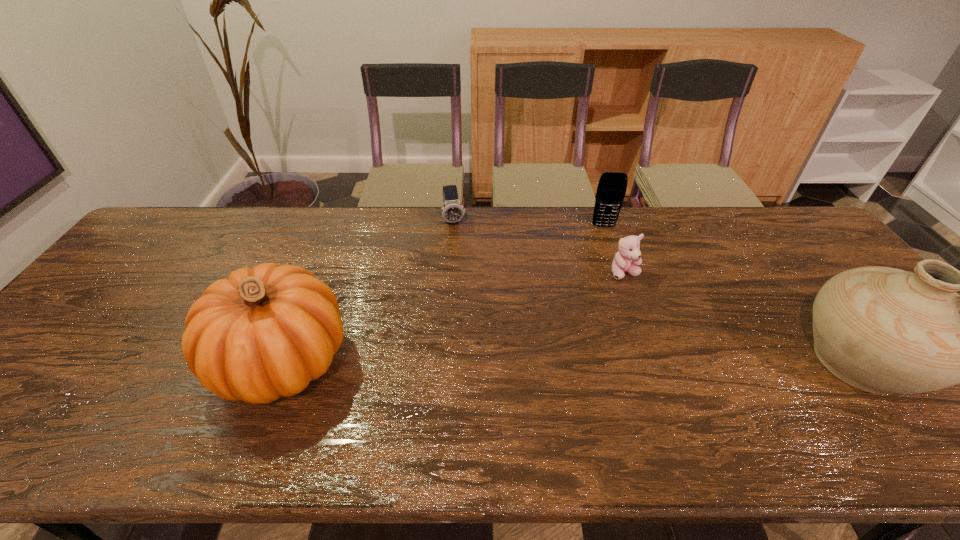
At what (x,y) coordinates should I click in order to perform the action: click on vacant region at the far left corner of the desktop. Please return your answer as a coordinate pair (x, y). The image size is (960, 540). Looking at the image, I should click on (136, 246).

The height and width of the screenshot is (540, 960). What are the coordinates of `vacant space at the far right corner of the desktop` in the screenshot? It's located at (756, 217).

Where is `vacant space at the near right corner of the desktop`? This screenshot has height=540, width=960. vacant space at the near right corner of the desktop is located at coordinates (917, 405).

The image size is (960, 540). What are the coordinates of `free space that is in between the pumpkin and the third shortest object` in the screenshot? It's located at (444, 294).

The image size is (960, 540). What are the coordinates of `free space between the third shortest object and the teddy bear` in the screenshot? It's located at coord(614,250).

The height and width of the screenshot is (540, 960). Identify the location of free point between the teddy bear and the watch. (540, 247).

This screenshot has height=540, width=960. Identify the location of free area in between the second object from left to right and the third nearest object. (540, 247).

Identify which object is the closest to the fourth object from right to left. Please provide its 2D coordinates. Your answer should be formatted as a tuple, i.e. [(x, y)], where the tuple contains the x and y coordinates of a point satisfying the conditions above.

[(264, 332)]

Identify which object is the second nearest to the leftmost object. Please provide its 2D coordinates. Your answer should be formatted as a tuple, i.e. [(x, y)], where the tuple contains the x and y coordinates of a point satisfying the conditions above.

[(626, 260)]

This screenshot has height=540, width=960. In order to click on free spot that satisfies the following two spatial constraints: 1. on the back side of the leftmost object; 2. on the right side of the teddy bear in this screenshot , I will do click(318, 273).